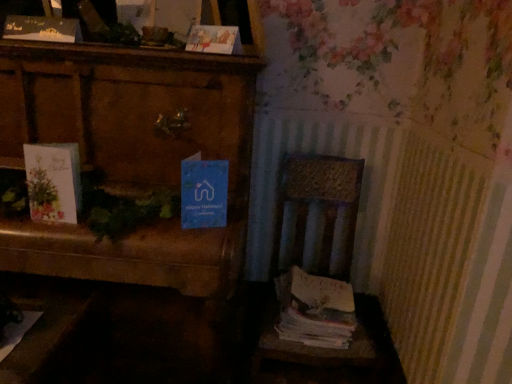
Question: Is white paper stack at right taller or shorter than matte black card at upper left, which is counted as the third paperback book, starting from the right?

Choices:
 (A) short
 (B) tall

Answer: (B)

Question: Is white paper stack at right inside or outside of matte black card at upper left, which is counted as the third paperback book, starting from the right?

Choices:
 (A) outside
 (B) inside

Answer: (A)

Question: Considering the real-world distances, which object is farthest from the wooden chair at lower right?

Choices:
 (A) wooden chest at left
 (B) white paper stack at right
 (C) matte paper card at upper center, which appears as the 2th paperback book when viewed from the top
 (D) matte paper greeting card at left
 (E) blue paper at center, the third paperback book viewed from the top

Answer: (D)

Question: Considering the real-world distances, which object is farthest from the wooden chair at lower right?

Choices:
 (A) matte black card at upper left, acting as the 1th paperback book starting from the top
 (B) white paper stack at right
 (C) wooden chest at left
 (D) blue paper at center, the first paperback book ordered from the bottom
 (E) matte paper greeting card at left

Answer: (A)